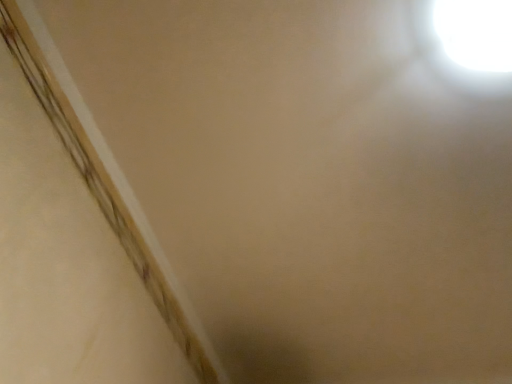
Where is `transparent glass window at upper right`? transparent glass window at upper right is located at coordinates (475, 33).

Looking at this image, in order to face transparent glass window at upper right, should I rotate leftwards or rightwards?

You should look right and rotate roughly 31.656 degrees.

This screenshot has height=384, width=512. What do you see at coordinates (475, 33) in the screenshot?
I see `transparent glass window at upper right` at bounding box center [475, 33].

You are a GUI agent. You are given a task and a screenshot of the screen. Output one action in this format:
    pyautogui.click(x=<x>, y=<y>)
    Task: Click on the transparent glass window at upper right
    The image size is (512, 384).
    Given the screenshot: What is the action you would take?
    coord(475,33)